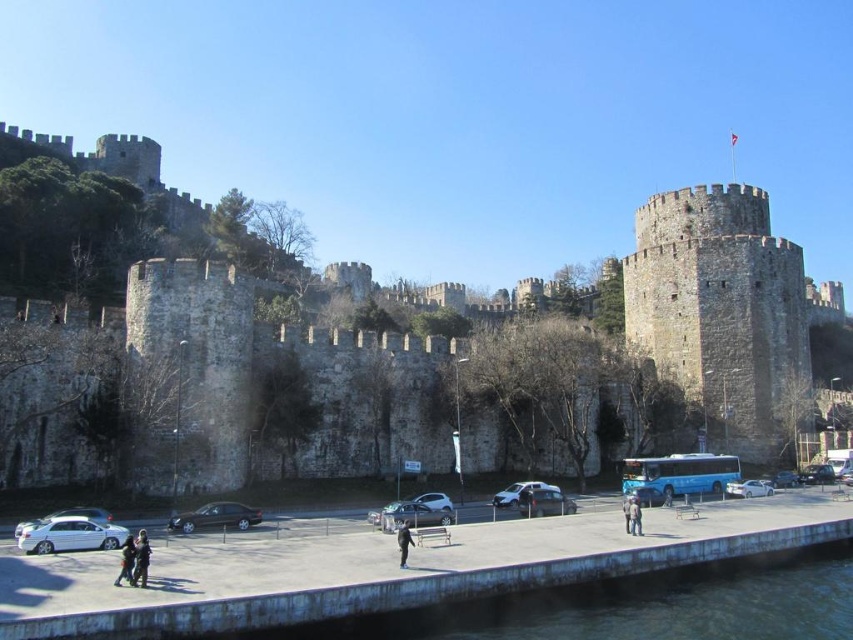
You are a tour guide explaining the fortress to visitors. You notice a silver metallic car at center and a dark gray jacket at lower center in the scene. Which object is taller?

The silver metallic car at center is taller than the dark gray jacket at lower center.

You are a tourist visiting the fortress and want to take a photo of the dark gray jacket at lower left without the silver metallic car at center blocking the view. Is this possible?

The dark gray jacket at lower left is behind the silver metallic car at center, so you can move around the car to take a photo of the jacket without the car blocking the view.